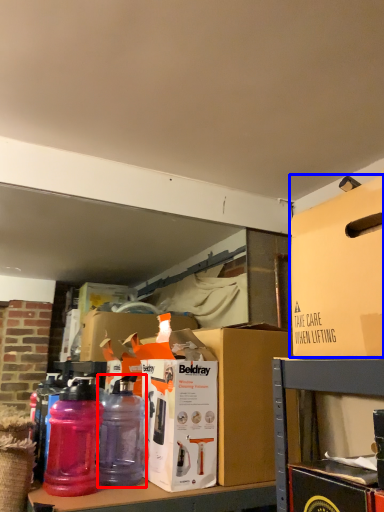
Question: Which point is further to the camera, bottle (highlighted by a red box) or box (highlighted by a blue box)?

Choices:
 (A) bottle
 (B) box

Answer: (A)